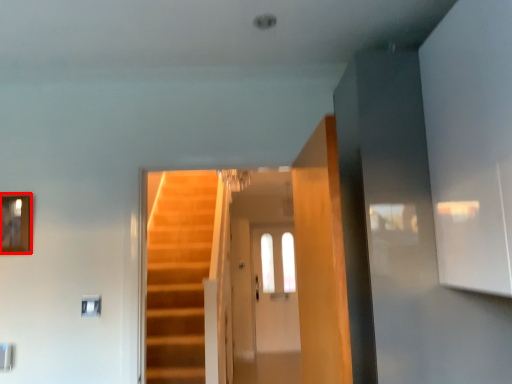
Question: From the image's perspective, what is the correct spatial relationship of picture frame (annotated by the red box) in relation to glass door?

Choices:
 (A) above
 (B) below

Answer: (A)